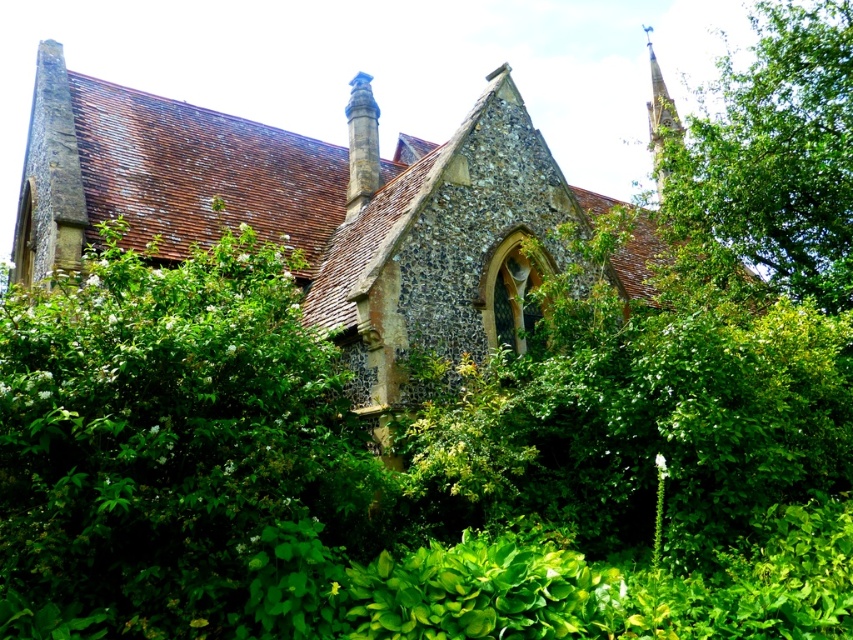
Does stone church at center appear under smooth stone spire at upper right?

Correct, stone church at center is located below smooth stone spire at upper right.

Does stone church at center appear on the left side of smooth stone spire at upper right?

Yes, stone church at center is to the left of smooth stone spire at upper right.

You are a GUI agent. You are given a task and a screenshot of the screen. Output one action in this format:
    pyautogui.click(x=<x>, y=<y>)
    Task: Click on the stone church at center
    This screenshot has height=640, width=853.
    Given the screenshot: What is the action you would take?
    (311, 211)

Can you confirm if stone church at center is thinner than green leafy tree at upper right?

In fact, stone church at center might be wider than green leafy tree at upper right.

Between stone church at center and green leafy tree at upper right, which one has less height?

green leafy tree at upper right is shorter.

Does point (479, 193) come farther from viewer compared to point (820, 124)?

No, (479, 193) is in front of (820, 124).

Locate an element on the screen. This screenshot has height=640, width=853. stone church at center is located at coordinates (311, 211).

Who is positioned more to the right, green leafy bush at center or smooth stone spire at upper right?

smooth stone spire at upper right is more to the right.

In the scene shown: Does green leafy bush at center have a smaller size compared to smooth stone spire at upper right?

Correct, green leafy bush at center occupies less space than smooth stone spire at upper right.

Between point (202, 592) and point (679, 131), which one is positioned in front?

Positioned in front is point (202, 592).

Identify the location of green leafy bush at center. (177, 452).